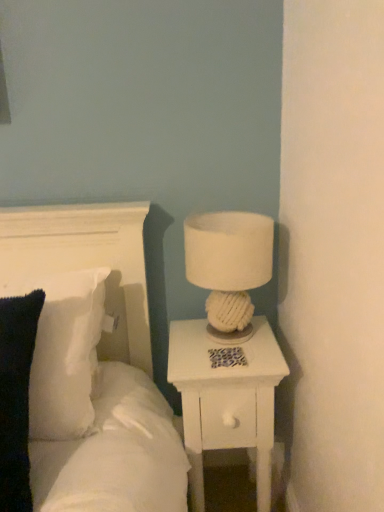
This screenshot has width=384, height=512. In order to click on white soft pillow at upper left in this screenshot , I will do `click(102, 365)`.

Describe the element at coordinates (229, 266) in the screenshot. I see `white fabric lampshade at upper right` at that location.

Where is `white wood nightstand at right`? This screenshot has height=512, width=384. white wood nightstand at right is located at coordinates (226, 397).

Between white fabric lampshade at upper right and white soft pillow at left, which one has less height?

white fabric lampshade at upper right.

This screenshot has height=512, width=384. Identify the location of table lamp behind the white soft pillow at left. (229, 266).

From the image's perspective, which one is positioned lower, white fabric lampshade at upper right or white soft pillow at left?

white soft pillow at left, from the image's perspective.

In the scene shown: Is the surface of white fabric lampshade at upper right in direct contact with white soft pillow at left?

white fabric lampshade at upper right and white soft pillow at left are not in contact.

Which of these two, white wood nightstand at right or white soft pillow at left, is wider?

white wood nightstand at right.

From a real-world perspective, is white wood nightstand at right positioned above or below white soft pillow at left?

In terms of real-world spatial position, white wood nightstand at right is below white soft pillow at left.

Is there a large distance between white wood nightstand at right and white soft pillow at left?

white wood nightstand at right is near white soft pillow at left, not far away.

Find the location of `pillow that is in front of the white wood nightstand at right`. pillow that is in front of the white wood nightstand at right is located at coordinates (64, 351).

Does white soft pillow at upper left have a lesser height compared to white soft pillow at left?

No.

Is white soft pillow at upper left directly adjacent to white soft pillow at left?

No, white soft pillow at upper left is not with white soft pillow at left.

Considering the relative sizes of white soft pillow at upper left and white soft pillow at left in the image provided, is white soft pillow at upper left wider than white soft pillow at left?

Yes.

Consider the image. From a real-world perspective, which object rests below the other?

In real-world perspective, white soft pillow at left is lower.

Could you tell me if white soft pillow at left is turned towards white wood nightstand at right?

No, white soft pillow at left is not facing towards white wood nightstand at right.

Is white soft pillow at left taller or shorter than white wood nightstand at right?

Considering their sizes, white soft pillow at left has less height than white wood nightstand at right.

Which object is further away from the camera, white soft pillow at left or white wood nightstand at right?

white wood nightstand at right is further from the camera.

Which is correct: white soft pillow at left is inside white wood nightstand at right, or outside of it?

white soft pillow at left is located beyond the bounds of white wood nightstand at right.

Can you see white soft pillow at upper left touching white fabric lampshade at upper right?

No, white soft pillow at upper left is not with white fabric lampshade at upper right.

Can white fabric lampshade at upper right be found inside white soft pillow at upper left?

Definitely not — white fabric lampshade at upper right is not inside white soft pillow at upper left.

In the image, is white soft pillow at upper left on the left side or the right side of white fabric lampshade at upper right?

Clearly, white soft pillow at upper left is on the left of white fabric lampshade at upper right in the image.

From the image's perspective, relative to white fabric lampshade at upper right, is white soft pillow at upper left above or below?

From the image's perspective, white soft pillow at upper left appears below white fabric lampshade at upper right.

Could white soft pillow at upper left be considered to be inside white wood nightstand at right?

No, white soft pillow at upper left is not inside white wood nightstand at right.

Considering the sizes of white wood nightstand at right and white soft pillow at upper left in the image, is white wood nightstand at right bigger or smaller than white soft pillow at upper left?

In the image, white wood nightstand at right appears to be smaller than white soft pillow at upper left.

Considering the relative sizes of white wood nightstand at right and white soft pillow at upper left in the image provided, is white wood nightstand at right shorter than white soft pillow at upper left?

In fact, white wood nightstand at right may be taller than white soft pillow at upper left.

Is white fabric lampshade at upper right turned away from white soft pillow at upper left?

No, white fabric lampshade at upper right is not facing the opposite direction of white soft pillow at upper left.

Between white fabric lampshade at upper right and white soft pillow at upper left, which one has less height?

Standing shorter between the two is white fabric lampshade at upper right.

Can you confirm if white fabric lampshade at upper right is thinner than white soft pillow at upper left?

Indeed, white fabric lampshade at upper right has a lesser width compared to white soft pillow at upper left.

From a real-world perspective, is white fabric lampshade at upper right above or below white soft pillow at upper left?

From a real-world perspective, white fabric lampshade at upper right is physically above white soft pillow at upper left.

I want to click on pillow located in front of the white fabric lampshade at upper right, so click(x=64, y=351).

The image size is (384, 512). In order to click on pillow on the left of the white wood nightstand at right in this screenshot , I will do `click(64, 351)`.

Which object lies further to the anchor point white wood nightstand at right, white fabric lampshade at upper right or white soft pillow at upper left?

The object further to white wood nightstand at right is white soft pillow at upper left.

Estimate the real-world distances between objects in this image. Which object is closer to white fabric lampshade at upper right, white soft pillow at left or white soft pillow at upper left?

white soft pillow at upper left lies closer to white fabric lampshade at upper right than the other object.

Which object lies further to the anchor point white soft pillow at left, white fabric lampshade at upper right or white soft pillow at upper left?

white fabric lampshade at upper right.

Considering their positions, is white fabric lampshade at upper right positioned closer to white wood nightstand at right than white soft pillow at left?

white fabric lampshade at upper right is closer to white wood nightstand at right.

From the image, which object appears to be nearer to white soft pillow at upper left, white wood nightstand at right or white soft pillow at left?

The object closer to white soft pillow at upper left is white soft pillow at left.

Based on their spatial positions, is white wood nightstand at right or white soft pillow at upper left closer to white fabric lampshade at upper right?

white wood nightstand at right lies closer to white fabric lampshade at upper right than the other object.

When comparing their distances from white soft pillow at upper left, does white fabric lampshade at upper right or white wood nightstand at right seem closer?

Among the two, white wood nightstand at right is located nearer to white soft pillow at upper left.

From the image, which object appears to be nearer to white soft pillow at upper left, white soft pillow at left or white wood nightstand at right?

white soft pillow at left.

Locate an element on the screen. bed between white soft pillow at left and white wood nightstand at right is located at coordinates (102, 365).

Locate an element on the screen. The height and width of the screenshot is (512, 384). nightstand situated between white soft pillow at upper left and white fabric lampshade at upper right from left to right is located at coordinates (226, 397).

Where is `bed between white soft pillow at left and white fabric lampshade at upper right in the horizontal direction`? The width and height of the screenshot is (384, 512). bed between white soft pillow at left and white fabric lampshade at upper right in the horizontal direction is located at coordinates (102, 365).

At what (x,y) coordinates should I click in order to perform the action: click on nightstand between white soft pillow at left and white fabric lampshade at upper right from left to right. Please return your answer as a coordinate pair (x, y). This screenshot has width=384, height=512. Looking at the image, I should click on (226, 397).